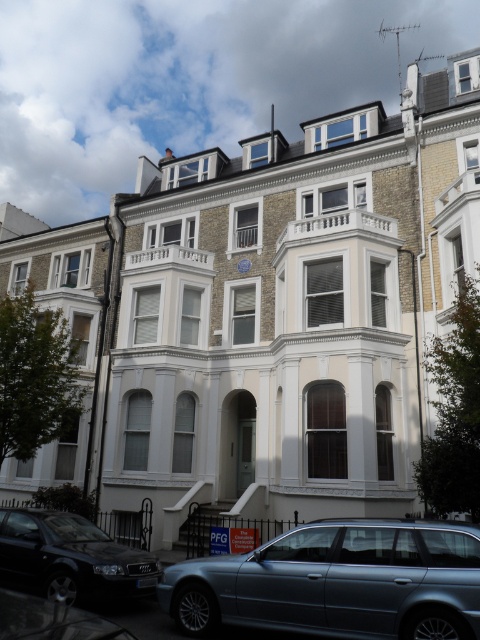
Question: Estimate the real-world distances between objects in this image. Which object is closer to the metallic silver car at lower center?

Choices:
 (A) shiny silver car at lower left
 (B) black metallic car at lower left

Answer: (B)

Question: Among these points, which one is farthest from the camera?

Choices:
 (A) (129, 593)
 (B) (10, 600)
 (C) (338, 557)

Answer: (A)

Question: Can you confirm if metallic silver car at lower center is smaller than shiny silver car at lower left?

Choices:
 (A) yes
 (B) no

Answer: (B)

Question: Is metallic silver car at lower center to the right of black metallic car at lower left from the viewer's perspective?

Choices:
 (A) yes
 (B) no

Answer: (A)

Question: Is black metallic car at lower left bigger than shiny silver car at lower left?

Choices:
 (A) yes
 (B) no

Answer: (A)

Question: Among these objects, which one is nearest to the camera?

Choices:
 (A) black metallic car at lower left
 (B) shiny silver car at lower left
 (C) metallic silver car at lower center

Answer: (B)